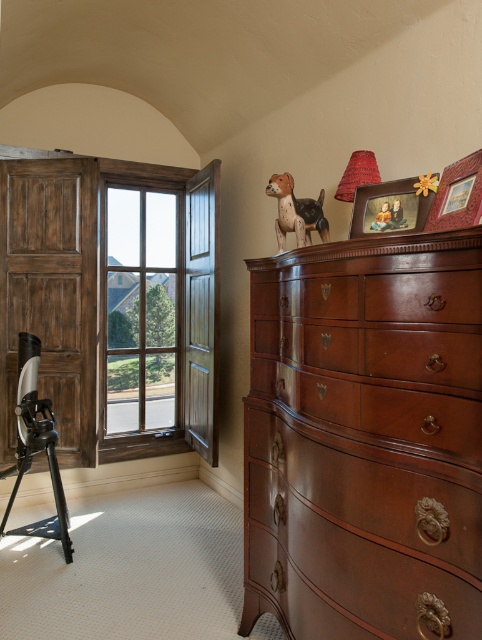
You are standing at the point marked as point (162, 312). You need to reach a door located 4.70 meters away. Is the distance sufficient to safely open the door without moving closer?

The distance between you and the door is 4.70 meters. Since the door requires being within a certain proximity to open comfortably, 4.70 meters may be too far to safely open it without moving closer. You should approach closer for better control.

Based on the photo, you are a delivery person trying to place a 1.5 meter long package between the clear glass window at center and the black matte tripod at left. Can the package fit in that space?

The clear glass window at center is 1.35 meters from the black matte tripod at left, so the 1.5 meter long package cannot fit in that space.

You are standing in the room and want to reach both the wooden picture frame at upper center and the wooden picture frame at upper right. Which one would you need to move closer to first?

You should move closer to the wooden picture frame at upper center first because it is closer to you than the wooden picture frame at upper right, which is further away.